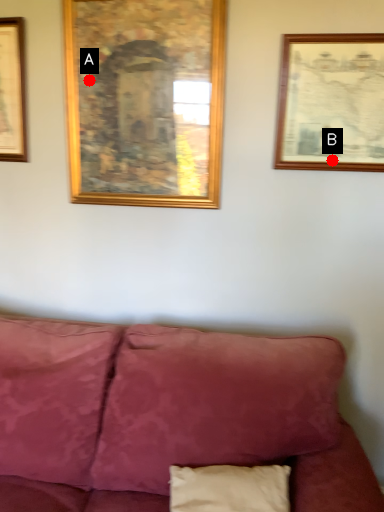
Question: Two points are circled on the image, labeled by A and B beside each circle. Which point is farther from the camera taking this photo?

Choices:
 (A) A is further
 (B) B is further

Answer: (A)